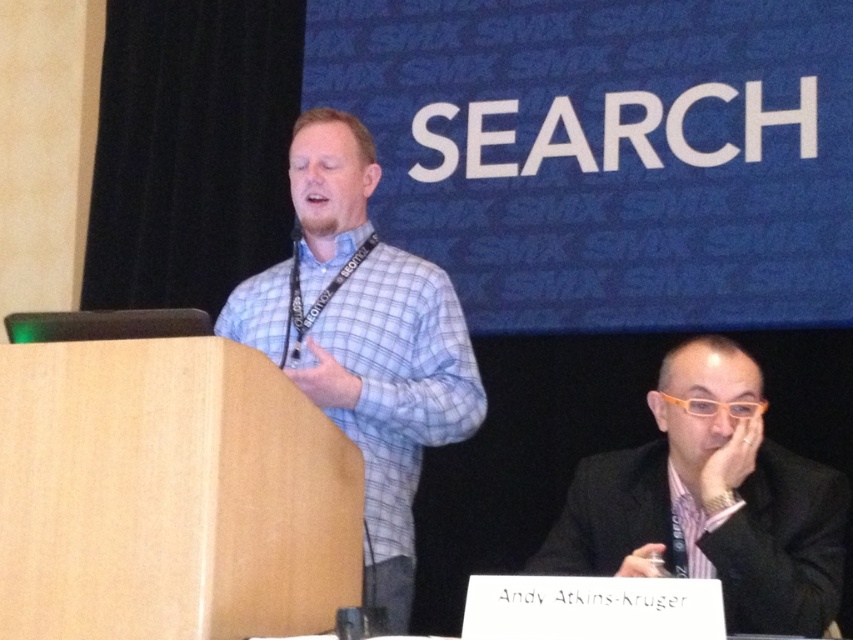
Between point (393, 248) and point (589, 572), which one is positioned behind?

Positioned behind is point (393, 248).

Who is more forward, (444,280) or (761,436)?

Point (761,436) is more forward.

Identify the location of blue checkered shirt at center. (363, 340).